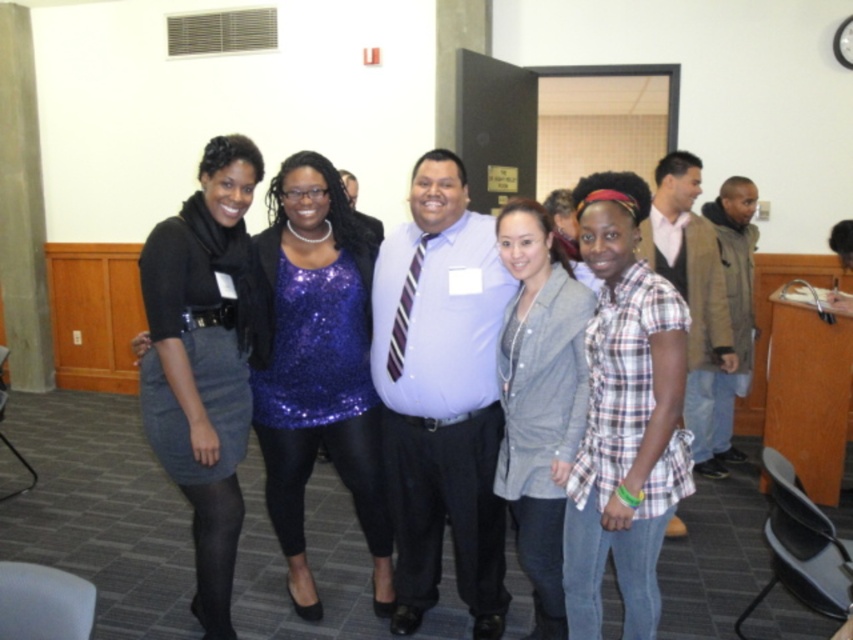
Can you confirm if plaid cotton shirt at center is positioned below denim jacket at center?

No, plaid cotton shirt at center is not below denim jacket at center.

Which of these two, plaid cotton shirt at center or denim jacket at center, stands taller?

denim jacket at center

Does point (596, 451) come behind point (570, 445)?

No, it is not.

Find the location of `plaid cotton shirt at center`. plaid cotton shirt at center is located at coordinates (624, 416).

Between point (489, 518) and point (500, 394), which one is positioned behind?

Point (489, 518)

Does matte blue shirt at center appear on the right side of denim jacket at center?

In fact, matte blue shirt at center is to the left of denim jacket at center.

Is point (462, 529) positioned after point (531, 212)?

Yes, point (462, 529) is behind point (531, 212).

At what (x,y) coordinates should I click in order to perform the action: click on matte blue shirt at center. Please return your answer as a coordinate pair (x, y). The image size is (853, 640). Looking at the image, I should click on (440, 396).

Is sparkly blue top at center below plaid cotton shirt at right?

Yes.

Looking at this image, which is more to the right, sparkly blue top at center or plaid cotton shirt at right?

plaid cotton shirt at right

Who is more distant from viewer, [303,532] or [693,397]?

Point [693,397]

Locate an element on the screen. sparkly blue top at center is located at coordinates (316, 365).